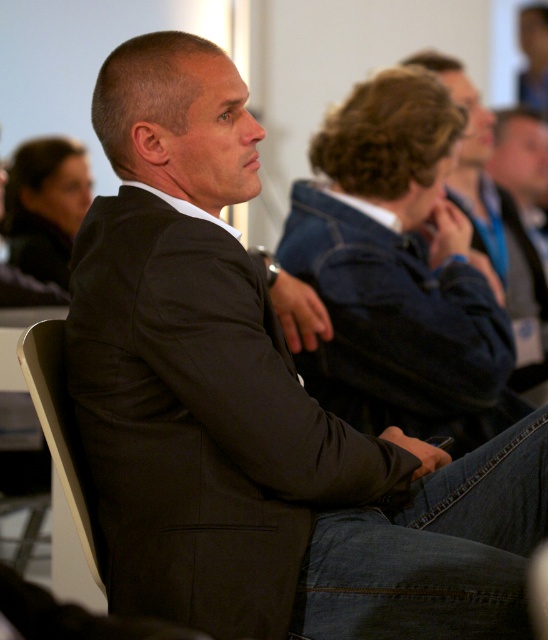
You are organizing a formal event and need to determine seating arrangements based on the image provided. Since the dark gray suit at center and the dark blue denim jacket at upper right are both present, which one should be seated closer to the front for the event?

The dark gray suit at center is already positioned in front of the dark blue denim jacket at upper right in the image, so it should remain closer to the front during the event.

In the conference room scene, there is a dark gray suit at center and a dark blue denim jacket at upper right. Which of these two items is positioned to the left when viewed from the front?

The dark gray suit at center is positioned to the left of the dark blue denim jacket at upper right.